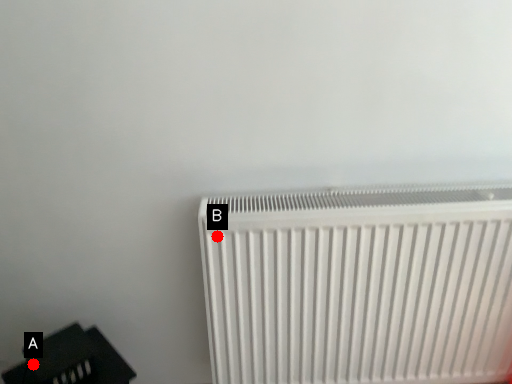
Question: Two points are circled on the image, labeled by A and B beside each circle. Which point is closer to the camera?

Choices:
 (A) A is closer
 (B) B is closer

Answer: (B)